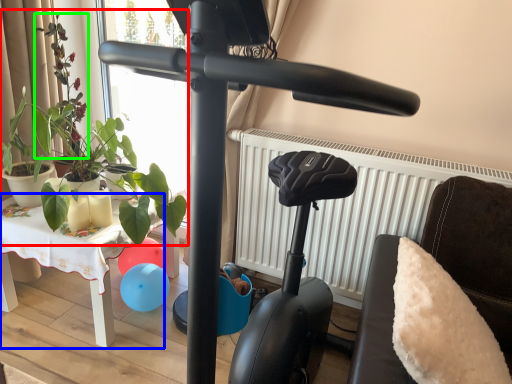
Question: Estimate the real-world distances between objects in this image. Which object is closer to plant (highlighted by a red box), table (highlighted by a blue box) or plant (highlighted by a green box)?

Choices:
 (A) table
 (B) plant

Answer: (B)